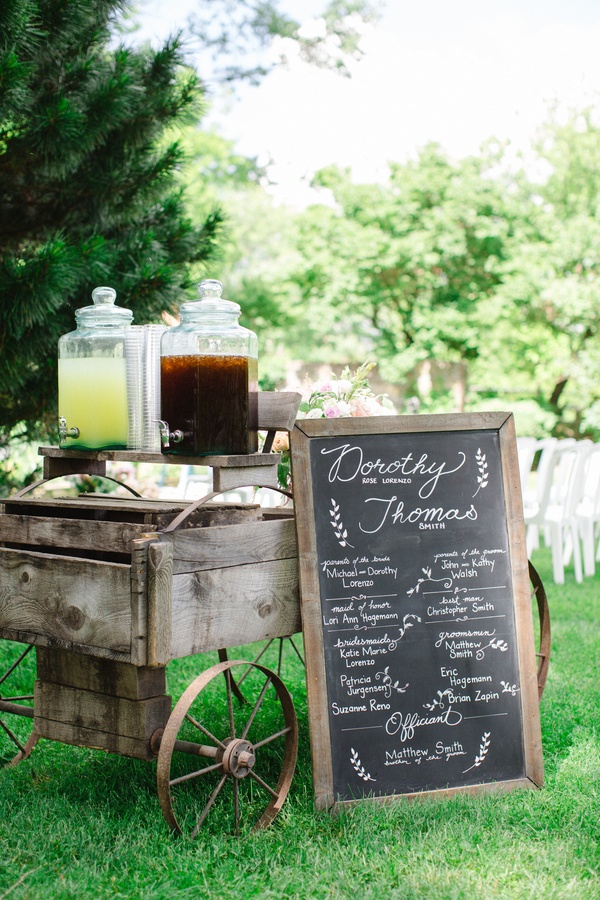
This screenshot has width=600, height=900. What are the coordinates of `drink containers` in the screenshot? It's located at (93, 400), (203, 400).